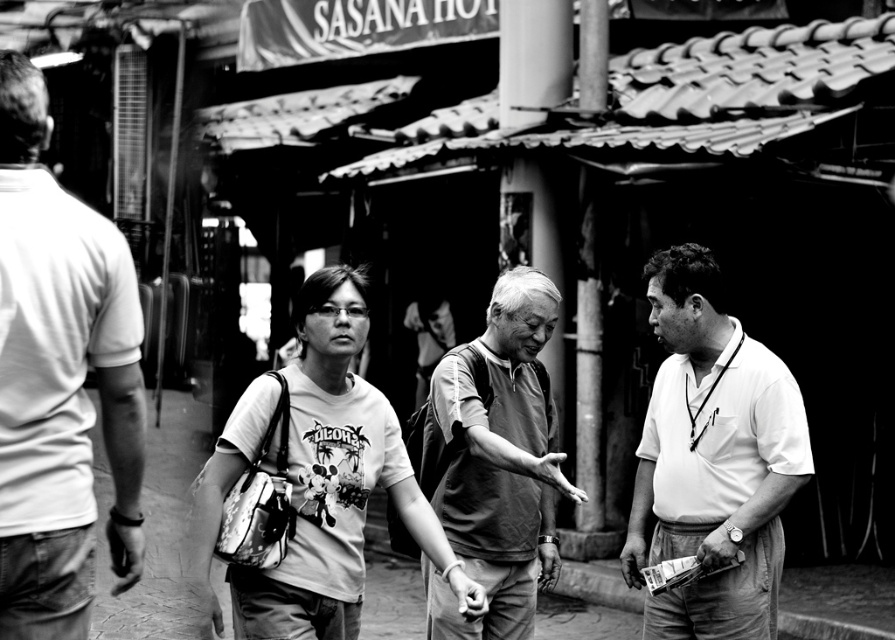
You are a photographer trying to capture a candid shot of the scene described. You want to ensure the white cotton shirt at right is in the frame. Based on its coordinates, where should you position your camera to include it?

The white cotton shirt at right is located at point (712,458), so position your camera to focus on that coordinate to include it in the frame.